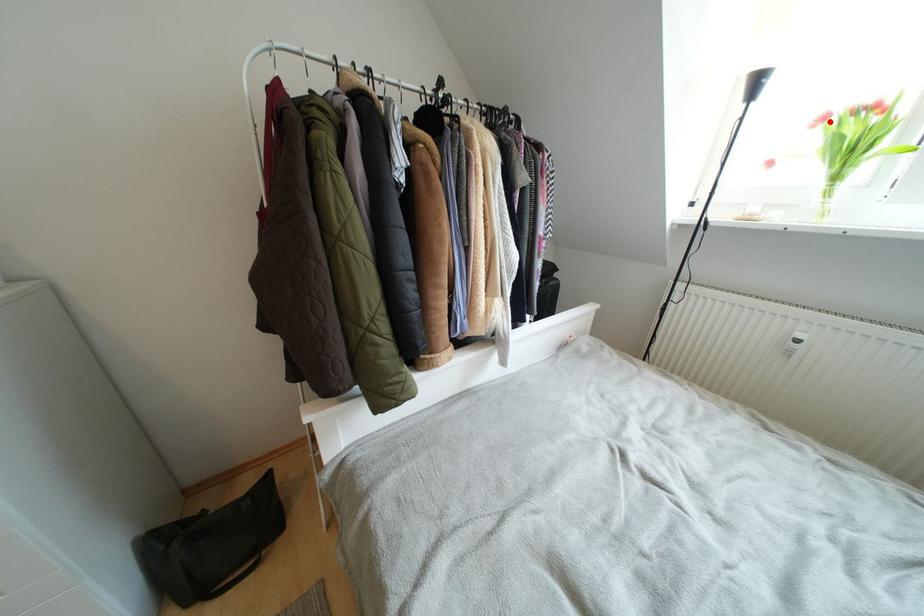
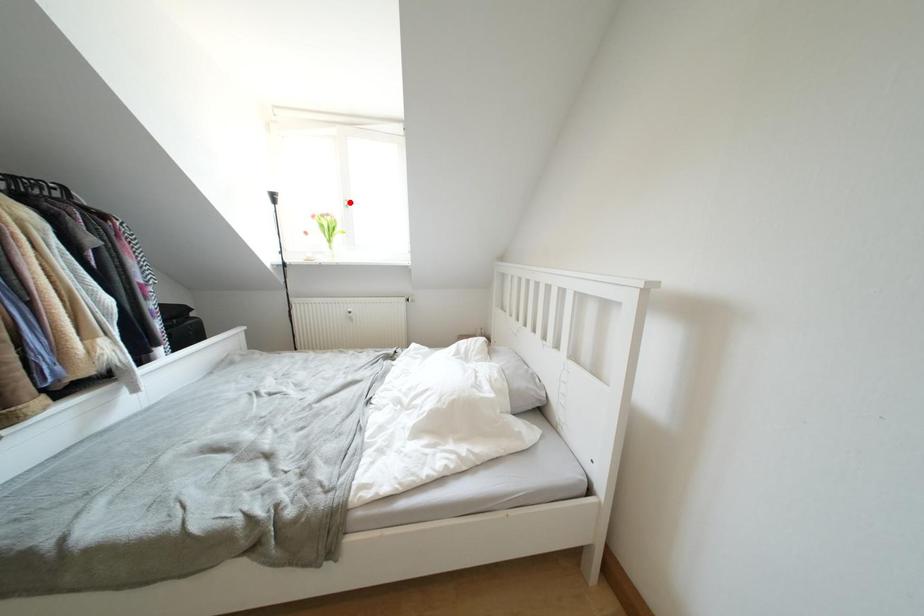
I am providing you with two images of the same scene from different viewpoints. A red point is marked on the first image and another point is marked on the second image. Is the red point in image1 aligned with the point shown in image2?

No